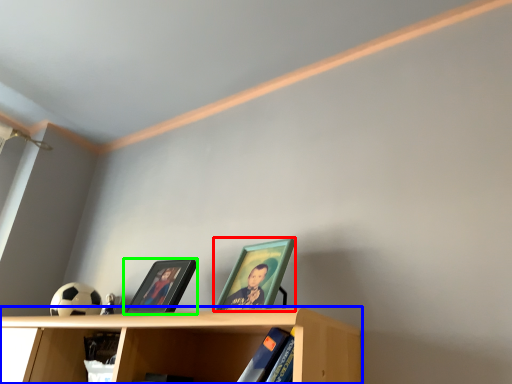
Question: Which is nearer to the picture frame (highlighted by a red box)? shelf (highlighted by a blue box) or picture frame (highlighted by a green box).

Choices:
 (A) shelf
 (B) picture frame

Answer: (A)